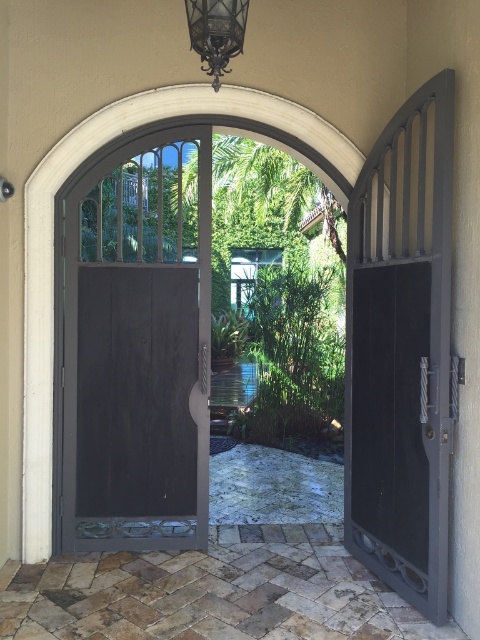
Which is below, dark wood door at center or black metal/light fixture at upper center?

dark wood door at center is below.

Which is in front, point (171, 272) or point (203, 17)?

Point (203, 17) is in front.

Image resolution: width=480 pixels, height=640 pixels. What do you see at coordinates (134, 348) in the screenshot?
I see `dark wood door at center` at bounding box center [134, 348].

Where is `dark wood door at center`? The width and height of the screenshot is (480, 640). dark wood door at center is located at coordinates (134, 348).